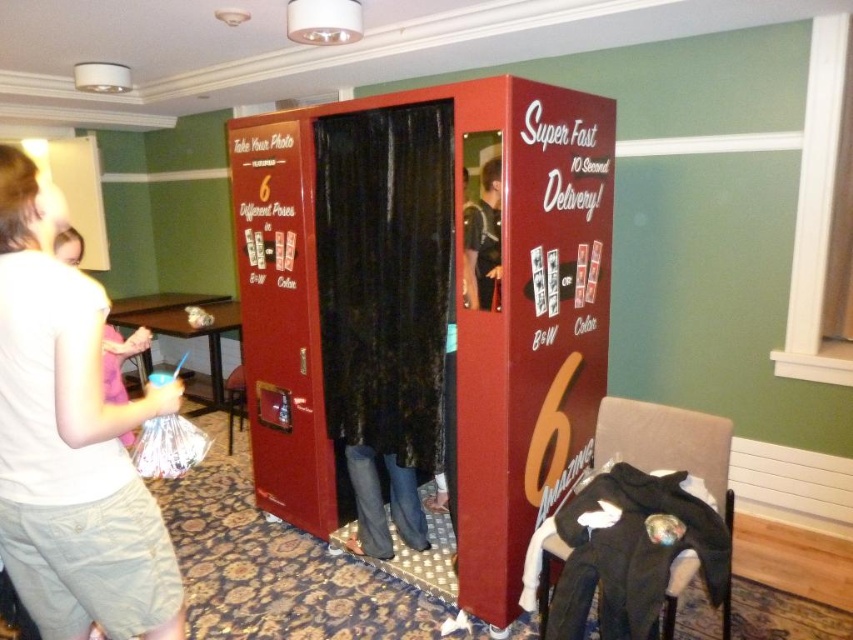
You need to place a dark blue shirt at center on a table that can only hold items narrower than the metallic red photo booth at center. Will the shirt fit?

The metallic red photo booth at center might be wider than dark blue shirt at center, so the shirt should fit on the table since it is narrower than the photo booth.

You are standing in front of the metallic red photo booth at center and want to reach the dark blue shirt at center. Which direction should you move to get there?

You should move to the right to reach the dark blue shirt at center because the metallic red photo booth at center is to the left of dark blue shirt at center.

You are taking a photo in the photo booth and want to focus on the point at coordinates point (33,387) and point (490,236). Which point should you adjust your focus to first if you want to capture both clearly?

You should focus on point (33,387) first because it is closer to the camera than point (490,236). Adjusting focus starting from the closer point ensures both are in frame.